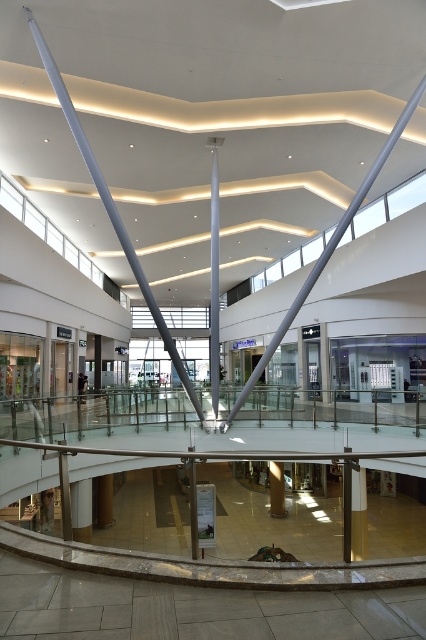
Does point (282, 332) lie in front of point (273, 474)?

Yes.

Find the location of a particular element. polished silver beam at center is located at coordinates (327, 250).

How distant is polished silver beam at center from smooth white pillar at center?

8.16 meters

Is point (389, 134) positioned in front of point (103, 524)?

Yes, it is in front of point (103, 524).

What are the coordinates of `polished silver beam at center` in the screenshot? It's located at (327, 250).

Is silver metallic beam at center to the right of matte silver beam at center from the viewer's perspective?

In fact, silver metallic beam at center is to the left of matte silver beam at center.

Is silver metallic beam at center behind matte silver beam at center?

No, it is in front of matte silver beam at center.

You are a GUI agent. You are given a task and a screenshot of the screen. Output one action in this format:
    pyautogui.click(x=<x>, y=<y>)
    Task: Click on the silver metallic beam at center
    
    Given the screenshot: What is the action you would take?
    pyautogui.click(x=109, y=205)

At what (x,y) coordinates should I click in order to perform the action: click on silver metallic beam at center. Please return your answer as a coordinate pair (x, y). The image size is (426, 640). Looking at the image, I should click on (109, 205).